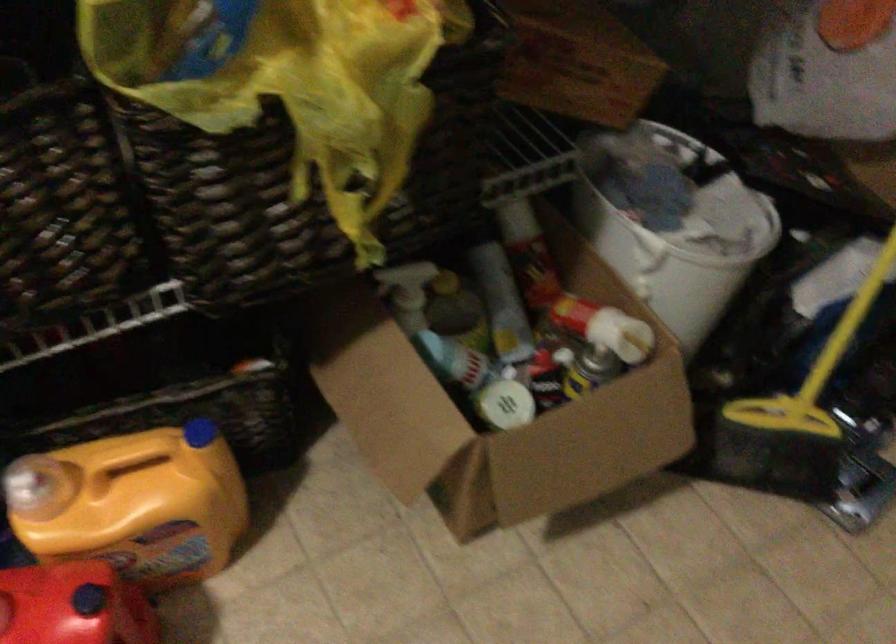
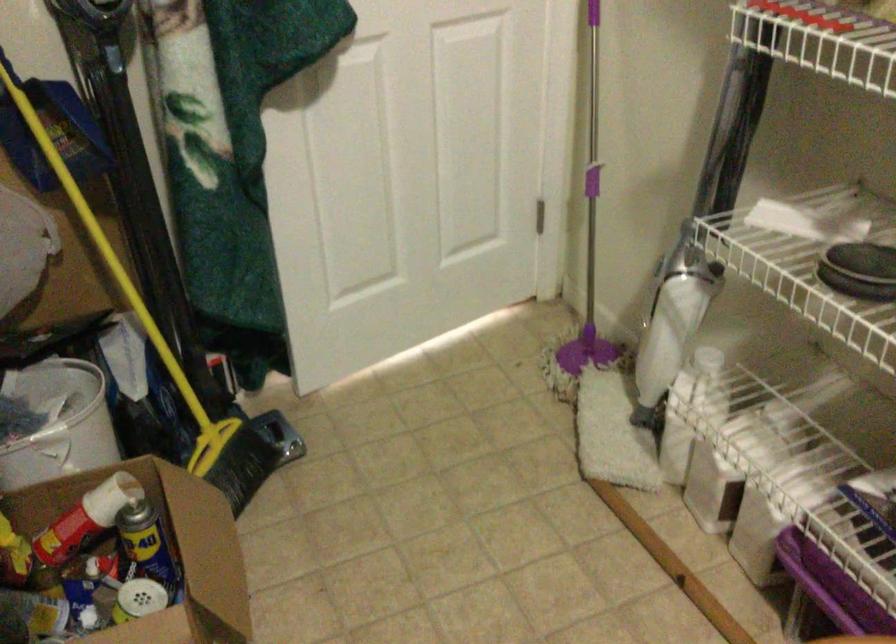
How did the camera likely rotate?

The camera's rotation is toward right-down.